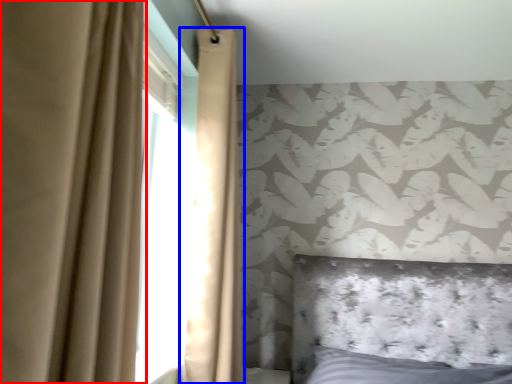
Question: Which object appears closest to the camera in this image, curtain (highlighted by a red box) or curtain (highlighted by a blue box)?

Choices:
 (A) curtain
 (B) curtain

Answer: (A)